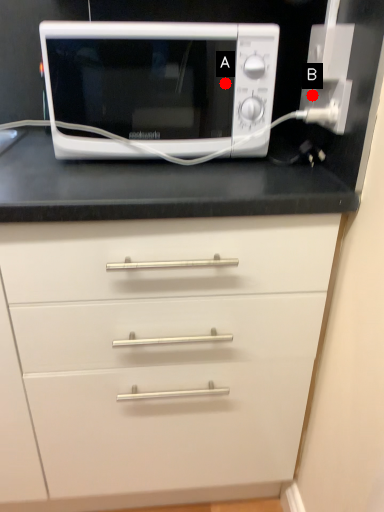
Question: Two points are circled on the image, labeled by A and B beside each circle. Which point is farther to the camera?

Choices:
 (A) A is further
 (B) B is further

Answer: (A)